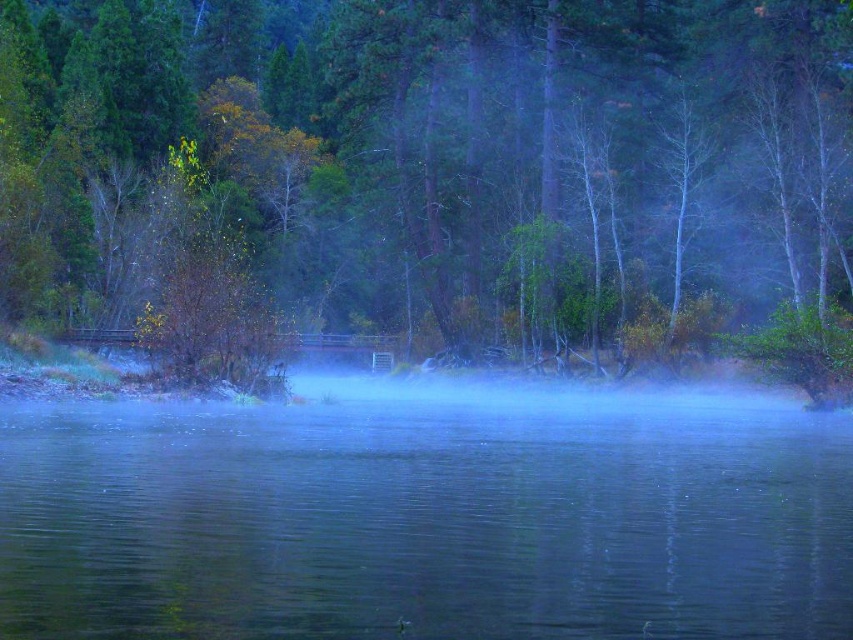
Question: Is green matte tree at center positioned at the back of clear water at center?

Choices:
 (A) yes
 (B) no

Answer: (A)

Question: Does green matte tree at center have a smaller size compared to clear water at center?

Choices:
 (A) no
 (B) yes

Answer: (A)

Question: Which point appears closest to the camera in this image?

Choices:
 (A) pyautogui.click(x=753, y=504)
 (B) pyautogui.click(x=444, y=248)

Answer: (A)

Question: Which of the following is the farthest from the observer?

Choices:
 (A) (431, 449)
 (B) (357, 6)

Answer: (B)

Question: Can you confirm if green matte tree at center is positioned below clear water at center?

Choices:
 (A) no
 (B) yes

Answer: (A)